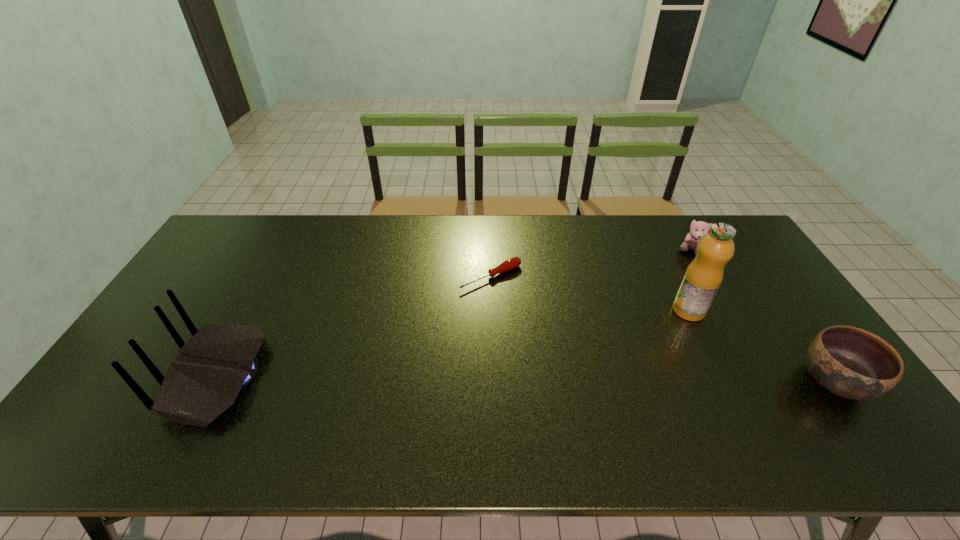
Where is `the fourth closest object relative to the fourth object from left to right`? The width and height of the screenshot is (960, 540). the fourth closest object relative to the fourth object from left to right is located at coordinates (219, 361).

Find the location of a particular element. This screenshot has height=540, width=960. object that can be found as the second closest to the rightmost object is located at coordinates (698, 229).